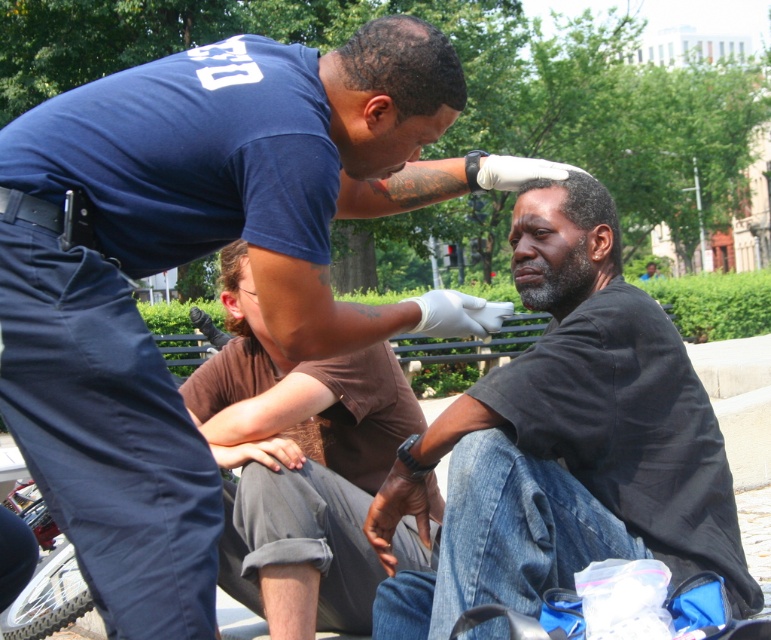
Based on the photo, is blue uniform shirt at upper left bigger than black matte shirt at center?

Yes, blue uniform shirt at upper left is bigger than black matte shirt at center.

This screenshot has width=771, height=640. What do you see at coordinates (194, 257) in the screenshot?
I see `blue uniform shirt at upper left` at bounding box center [194, 257].

Who is more distant from viewer, (229, 70) or (615, 280)?

The point (615, 280) is behind.

Identify the location of blue uniform shirt at upper left. (194, 257).

This screenshot has height=640, width=771. What do you see at coordinates (194, 257) in the screenshot?
I see `blue uniform shirt at upper left` at bounding box center [194, 257].

Which is behind, point (79, 202) or point (241, 561)?

The point (241, 561) is more distant.

The image size is (771, 640). In order to click on blue uniform shirt at upper left in this screenshot , I will do `click(194, 257)`.

Which of these two, black matte shirt at center or brown cotton shirt at center, stands shorter?

Standing shorter between the two is black matte shirt at center.

Is point (450, 593) in front of point (231, 492)?

That is True.

Does point (513, 444) lie in front of point (335, 481)?

That is True.

Where is `black matte shirt at center`? The image size is (771, 640). black matte shirt at center is located at coordinates (564, 442).